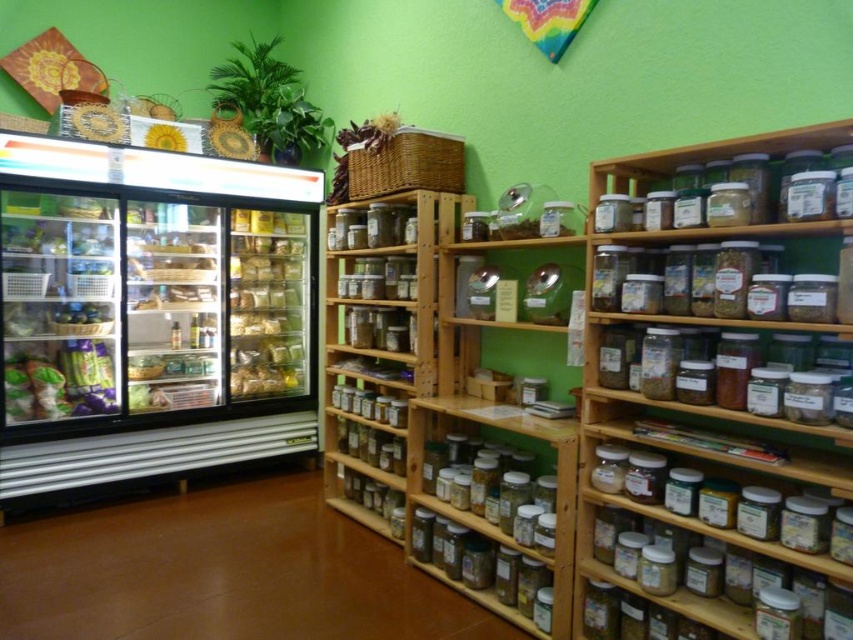
You are a customer looking to buy some snacks. You see the clear plastic jars at upper right and the translucent plastic bag at center. Which one can hold more snacks?

The clear plastic jars at upper right is larger in size than the translucent plastic bag at center, so it can hold more snacks.

You are a delivery person who just arrived at the store with a package that needs to be placed between the clear glass refrigerator at left and the translucent plastic bag at center. The package is 12 inches long. Do you think it will fit between them?

The clear glass refrigerator at left and translucent plastic bag at center are 11.97 inches apart from each other. Since the package is 12 inches long, it will not fit between them as the space is slightly smaller than the package.

You are a customer in the store and want to grab both the clear plastic jars at upper right and the clear glass refrigerator at left. Which one is closer to the entrance?

The clear glass refrigerator at left is closer to the entrance because the clear plastic jars at upper right is to the right of it, meaning the refrigerator is positioned between the entrance and the jars.